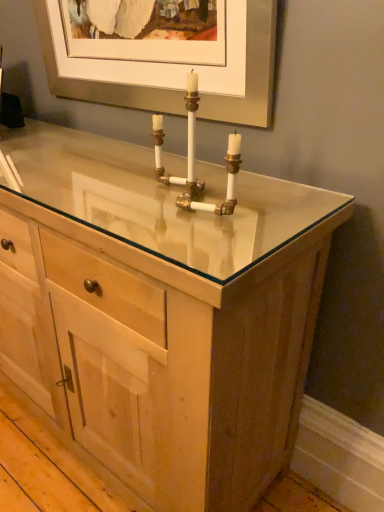
You are a GUI agent. You are given a task and a screenshot of the screen. Output one action in this format:
    pyautogui.click(x=<x>, y=<y>)
    Task: Click on the free spot in front of white brass pipe at center
    
    Given the screenshot: What is the action you would take?
    pyautogui.click(x=188, y=236)